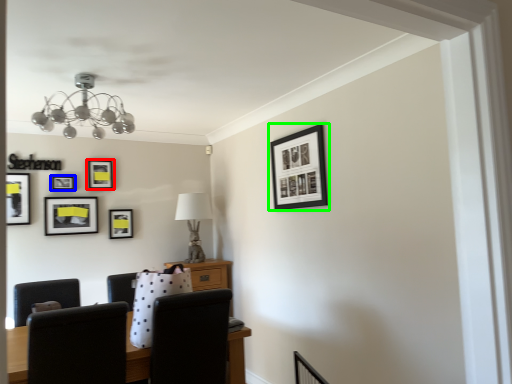
Question: Considering the real-world distances, which object is closest to picture frame (highlighted by a red box)? picture frame (highlighted by a blue box) or picture frame (highlighted by a green box).

Choices:
 (A) picture frame
 (B) picture frame

Answer: (A)